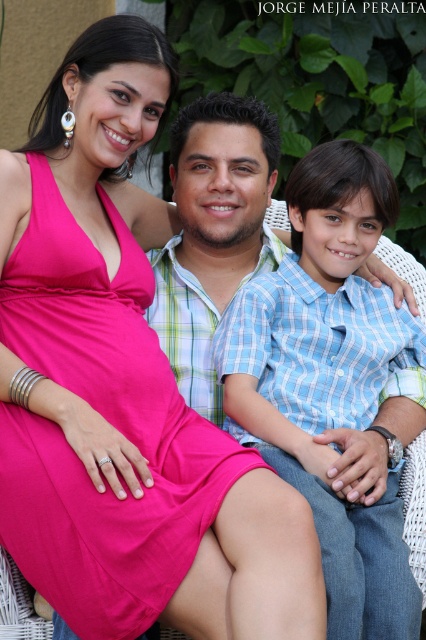
You are standing in front of the family photo. There are two points marked on the image, one at coordinates point (103,589) and another at point (374,572). Which point is nearer to you?

Point (103,589) is closer to the camera than point (374,572), so the point at coordinates point (103,589) is nearer to you.

You are a photographer trying to capture a group photo of the family. You need to ensure that both the matte pink dress at center and the blue plaid shirt at center are clearly visible in the frame. Given their sizes, which clothing item might require more space in the composition to avoid being cropped out?

The matte pink dress at center has a larger width than the blue plaid shirt at center, so it might require more space in the composition to avoid being cropped out.